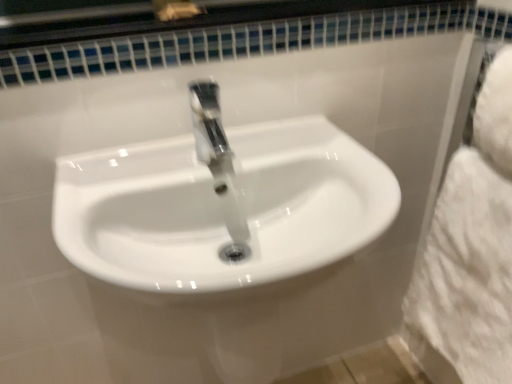
Question: From a real-world perspective, is white fluffy bath towel at right positioned over white glossy sink at center based on gravity?

Choices:
 (A) yes
 (B) no

Answer: (B)

Question: Is white fluffy bath towel at right looking in the opposite direction of white glossy sink at center?

Choices:
 (A) yes
 (B) no

Answer: (A)

Question: Considering the relative sizes of white fluffy bath towel at right and white glossy sink at center in the image provided, is white fluffy bath towel at right thinner than white glossy sink at center?

Choices:
 (A) yes
 (B) no

Answer: (A)

Question: Is the depth of white fluffy bath towel at right less than that of white glossy sink at center?

Choices:
 (A) yes
 (B) no

Answer: (B)

Question: Is white fluffy bath towel at right completely or partially outside of white glossy sink at center?

Choices:
 (A) yes
 (B) no

Answer: (A)

Question: Is white fluffy bath towel at right smaller than white glossy sink at center?

Choices:
 (A) no
 (B) yes

Answer: (B)

Question: Considering the relative sizes of white glossy sink at center and white fluffy bath towel at right in the image provided, is white glossy sink at center smaller than white fluffy bath towel at right?

Choices:
 (A) yes
 (B) no

Answer: (B)

Question: Considering the relative sizes of white glossy sink at center and white fluffy bath towel at right in the image provided, is white glossy sink at center wider than white fluffy bath towel at right?

Choices:
 (A) yes
 (B) no

Answer: (A)

Question: Is white glossy sink at center at the left side of white fluffy bath towel at right?

Choices:
 (A) yes
 (B) no

Answer: (A)

Question: Can you confirm if white glossy sink at center is taller than white fluffy bath towel at right?

Choices:
 (A) yes
 (B) no

Answer: (B)

Question: From a real-world perspective, is white glossy sink at center positioned under white fluffy bath towel at right based on gravity?

Choices:
 (A) no
 (B) yes

Answer: (A)

Question: Is white glossy sink at center positioned beyond the bounds of white fluffy bath towel at right?

Choices:
 (A) no
 (B) yes

Answer: (B)

Question: Is point coord(456,364) positioned closer to the camera than point coord(325,226)?

Choices:
 (A) closer
 (B) farther

Answer: (B)